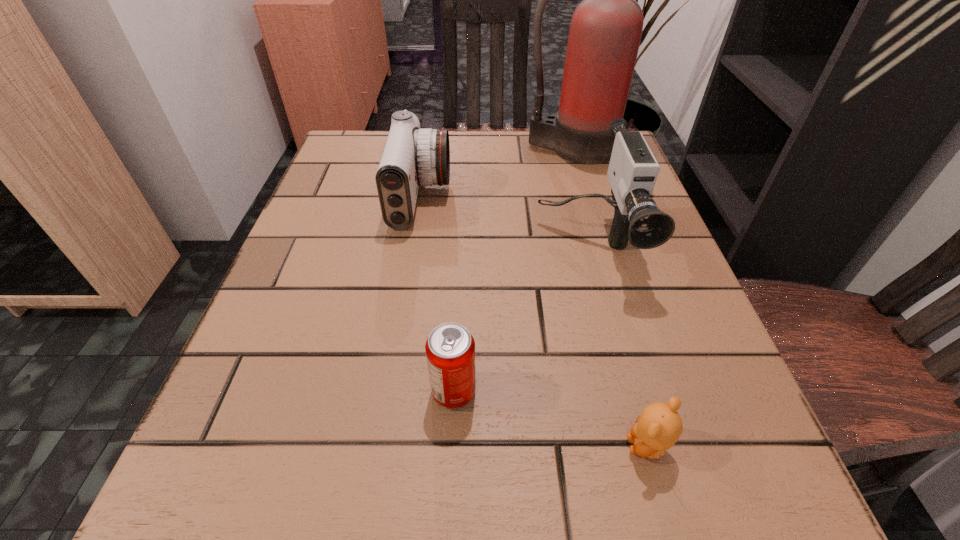
Where is `free space between the nearest object and the left camcorder`? free space between the nearest object and the left camcorder is located at coordinates (534, 322).

Identify which object is located as the third nearest to the second nearest object. Please provide its 2D coordinates. Your answer should be formatted as a tuple, i.e. [(x, y)], where the tuple contains the x and y coordinates of a point satisfying the conditions above.

[(412, 156)]

Identify which object is the fourth nearest to the third tallest object. Please provide its 2D coordinates. Your answer should be formatted as a tuple, i.e. [(x, y)], where the tuple contains the x and y coordinates of a point satisfying the conditions above.

[(657, 429)]

The image size is (960, 540). Identify the location of vacant region that satisfies the following two spatial constraints: 1. at the nozzle of the tallest object; 2. on the face of the nearest object. (658, 446).

Locate an element on the screen. The height and width of the screenshot is (540, 960). vacant space that satisfies the following two spatial constraints: 1. on the surface of the soda can; 2. on the right side of the third tallest object is located at coordinates (389, 390).

This screenshot has height=540, width=960. I want to click on vacant space that satisfies the following two spatial constraints: 1. on the surface of the second shortest object; 2. on the right side of the third shortest object, so click(389, 390).

The image size is (960, 540). Find the location of `free point that satisfies the following two spatial constraints: 1. at the nozzle of the fire extinguisher; 2. on the face of the shortest object`. free point that satisfies the following two spatial constraints: 1. at the nozzle of the fire extinguisher; 2. on the face of the shortest object is located at coordinates (658, 446).